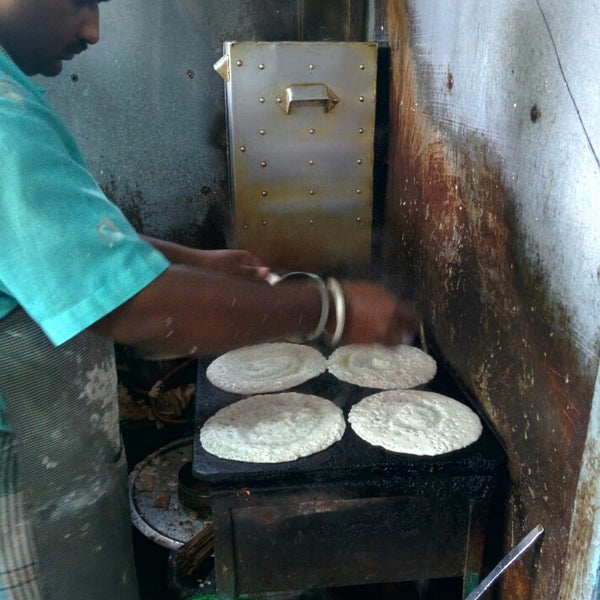
This screenshot has height=600, width=600. Identify the location of greasy wall. (480, 333).